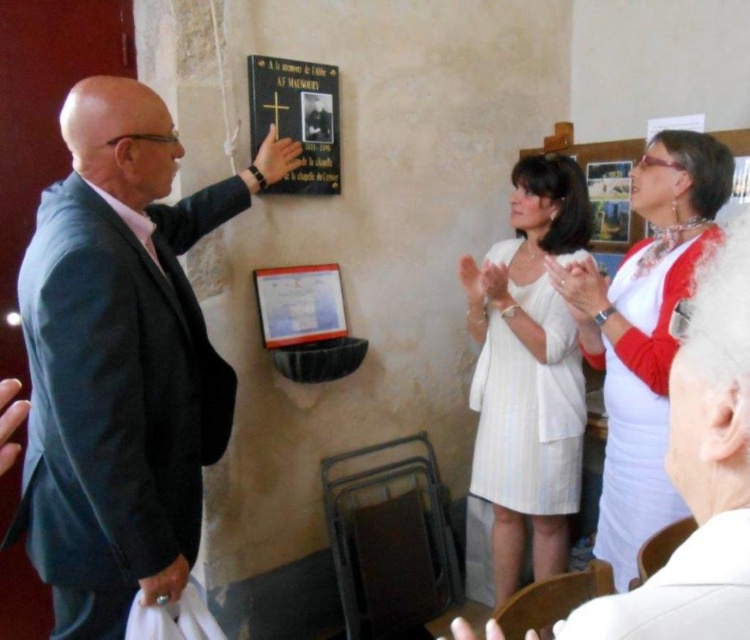
Question: Estimate the real-world distances between objects in this image. Which object is closer to the white matte dress at center?

Choices:
 (A) black matte plaque at upper center
 (B) white textured dress at center
 (C) white satin dress at upper right
 (D) dark blue suit at left

Answer: (C)

Question: Does white matte dress at center lie in front of black matte plaque at upper center?

Choices:
 (A) yes
 (B) no

Answer: (A)

Question: Among these objects, which one is farthest from the camera?

Choices:
 (A) black matte plaque at upper center
 (B) white matte dress at center

Answer: (A)

Question: Among these objects, which one is nearest to the camera?

Choices:
 (A) white matte dress at center
 (B) white textured dress at center
 (C) black matte plaque at upper center
 (D) white satin dress at upper right

Answer: (A)

Question: Does white textured dress at center have a lesser width compared to black matte plaque at upper center?

Choices:
 (A) no
 (B) yes

Answer: (A)

Question: Where is dark blue suit at left located in relation to black matte plaque at upper center in the image?

Choices:
 (A) above
 (B) below

Answer: (B)